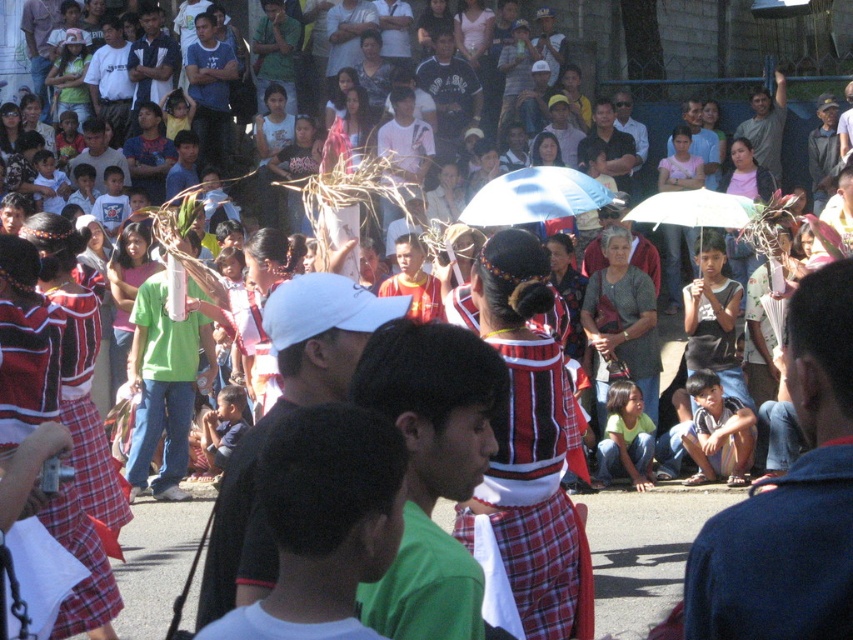
I want to click on green fabric shirt at center, so click(431, 472).

Is point (409, 488) more distant than point (213, 122)?

No, it is not.

What are the coordinates of `green fabric shirt at center` in the screenshot? It's located at (431, 472).

Who is taller, denim jacket at lower right or white cap at center?

Standing taller between the two is denim jacket at lower right.

Is denim jacket at lower right thinner than white cap at center?

Incorrect, denim jacket at lower right's width is not less than white cap at center's.

Is point (792, 477) closer to camera compared to point (221, 561)?

Yes.

Locate an element on the screen. denim jacket at lower right is located at coordinates (790, 497).

Can you confirm if denim jacket at lower right is wider than dark blue jersey at center?

Yes, denim jacket at lower right is wider than dark blue jersey at center.

Is denim jacket at lower right to the left of dark blue jersey at center from the viewer's perspective?

In fact, denim jacket at lower right is to the right of dark blue jersey at center.

Which is behind, point (827, 625) or point (471, 122)?

Point (471, 122)

Locate an element on the screen. This screenshot has width=853, height=640. denim jacket at lower right is located at coordinates (790, 497).